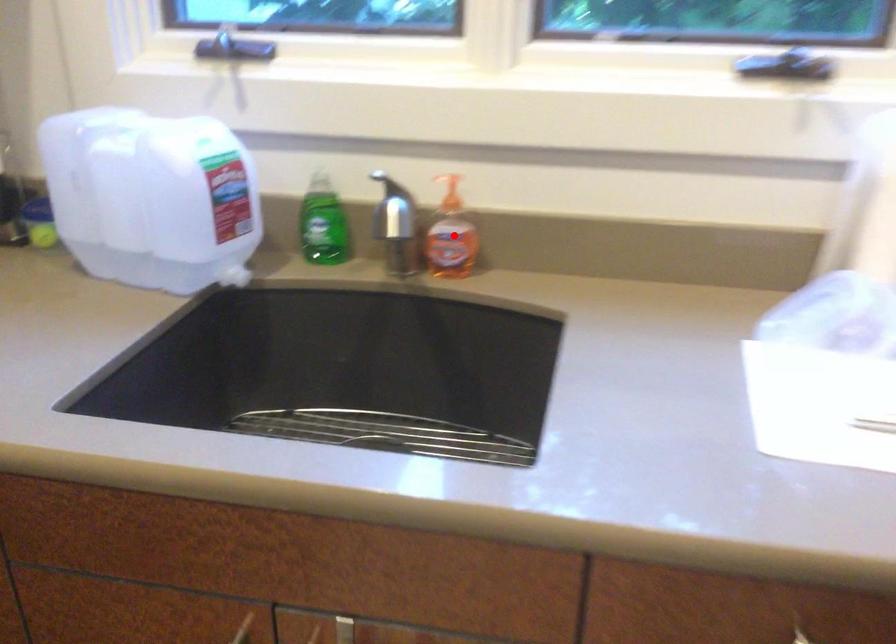
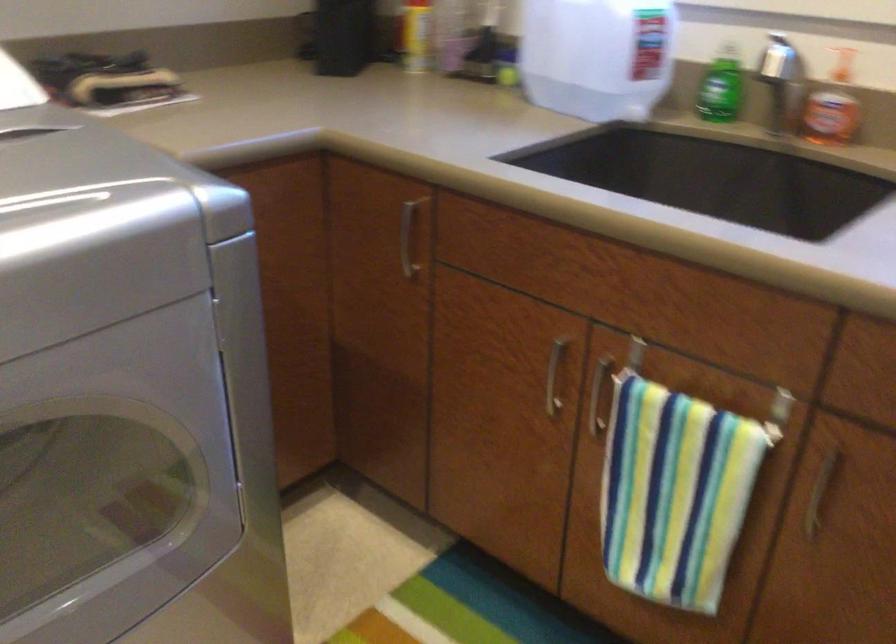
Question: I am providing you with two images of the same scene from different viewpoints. In image1, a red point is highlighted. Considering the same 3D point in image2, which of the following is correct?

Choices:
 (A) It is closer
 (B) It is farther

Answer: (B)